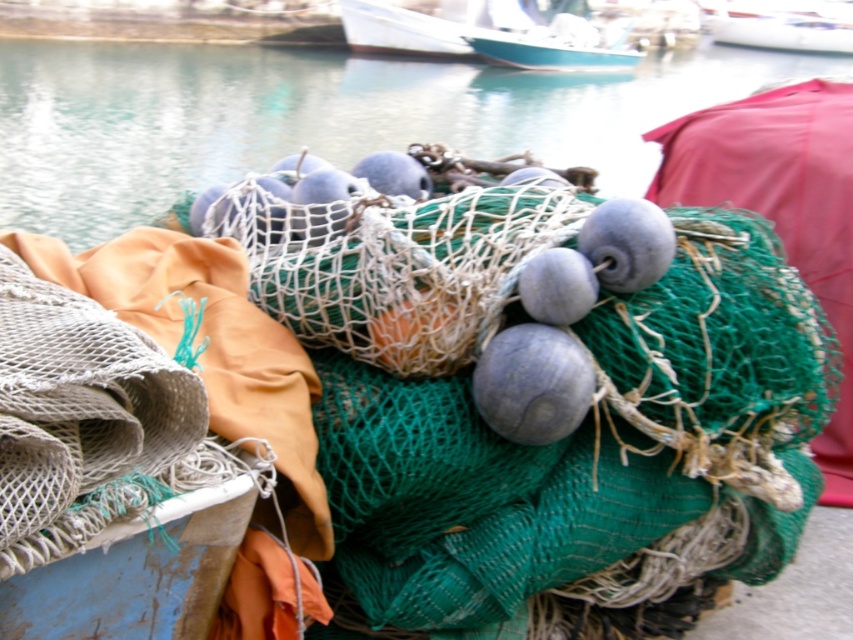
Question: Estimate the real-world distances between objects in this image. Which object is farther from the green netting at center?

Choices:
 (A) white glossy boat at upper right
 (B) teal glossy boat at upper center

Answer: (A)

Question: From the image, what is the correct spatial relationship of green netting at center in relation to white glossy boat at upper right?

Choices:
 (A) below
 (B) above

Answer: (A)

Question: Is green netting at center below teal glossy boat at upper center?

Choices:
 (A) yes
 (B) no

Answer: (A)

Question: Can you confirm if green netting at center is positioned to the right of teal glossy boat at upper center?

Choices:
 (A) yes
 (B) no

Answer: (B)

Question: Which object is positioned farthest from the green netting at center?

Choices:
 (A) teal glossy boat at upper center
 (B) white glossy boat at upper right

Answer: (B)

Question: Estimate the real-world distances between objects in this image. Which object is closer to the white glossy boat at upper right?

Choices:
 (A) teal glossy boat at upper center
 (B) green netting at center

Answer: (A)